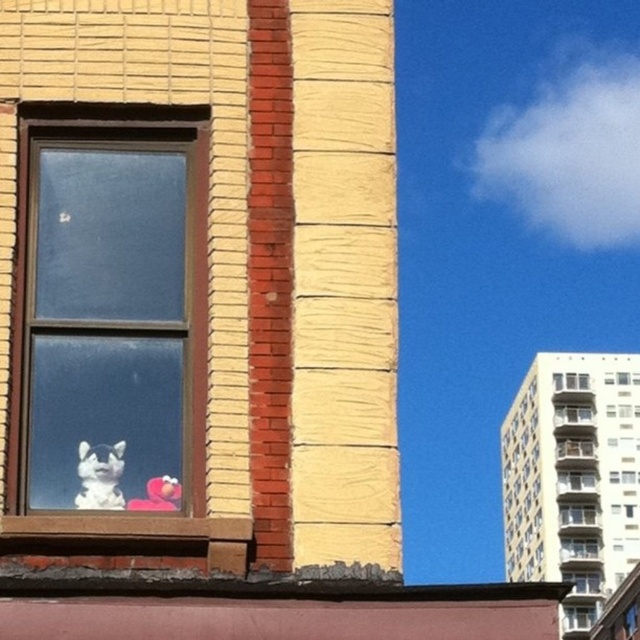
You are standing in front of a building and see two points marked on its facade. The first point is at coordinates point (99,262) and the second is at point (88,490). If you want to touch both points starting from the nearest one to you, which point should you touch first?

You should touch point (88,490) first because it is closer to you than point (99,262), which is further away.

You are a delivery person trying to determine the best window to place a package. The package requires placement in the largest available window space. Which window should you choose between the clear glass window at left and the clear glass window at upper right?

The clear glass window at left is bigger than the clear glass window at upper right, so you should choose the clear glass window at left to place the package.